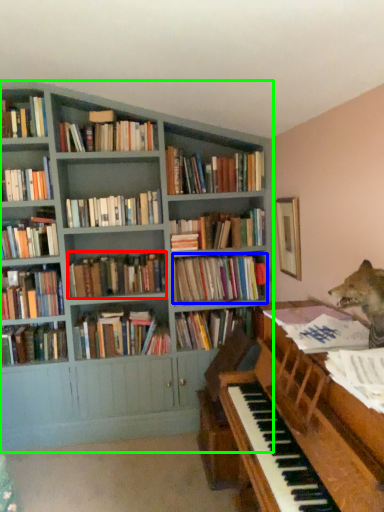
Question: Estimate the real-world distances between objects in this image. Which object is closer to book (highlighted by a red box), book (highlighted by a blue box) or bookcase (highlighted by a green box)?

Choices:
 (A) book
 (B) bookcase

Answer: (A)